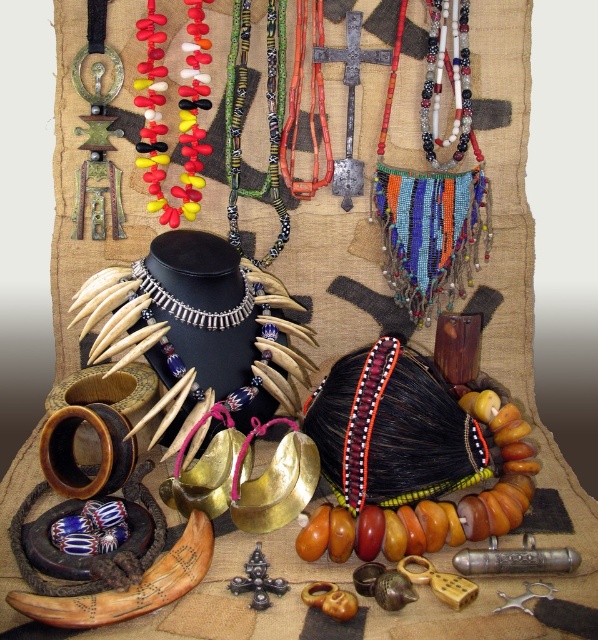
Can you confirm if beaded fabric necklace at center is shorter than rubber beads necklace at center?

Incorrect, beaded fabric necklace at center's height does not fall short of rubber beads necklace at center's.

Is beaded fabric necklace at center below rubber beads necklace at center?

Correct, beaded fabric necklace at center is located below rubber beads necklace at center.

Image resolution: width=598 pixels, height=640 pixels. I want to click on beaded fabric necklace at center, so click(x=435, y=182).

At what (x,y) coordinates should I click in order to perform the action: click on beaded fabric necklace at center. Please return your answer as a coordinate pair (x, y). This screenshot has height=640, width=598. Looking at the image, I should click on (435, 182).

Between beaded fabric necklace at center and multicolored beaded necklace at center, which one is positioned higher?

multicolored beaded necklace at center

Between beaded fabric necklace at center and multicolored beaded necklace at center, which one appears on the right side from the viewer's perspective?

From the viewer's perspective, beaded fabric necklace at center appears more on the right side.

Is point (385, 273) closer to camera compared to point (273, 97)?

No, it is not.

Where is `beaded fabric necklace at center`? Image resolution: width=598 pixels, height=640 pixels. beaded fabric necklace at center is located at coordinates (435, 182).

Between point (437, 116) and point (248, 314), which one is positioned behind?

Positioned behind is point (437, 116).

Who is more forward, (431, 180) or (236, 317)?

Point (236, 317) is in front.

The height and width of the screenshot is (640, 598). Find the location of `beaded fabric necklace at center`. beaded fabric necklace at center is located at coordinates (435, 182).